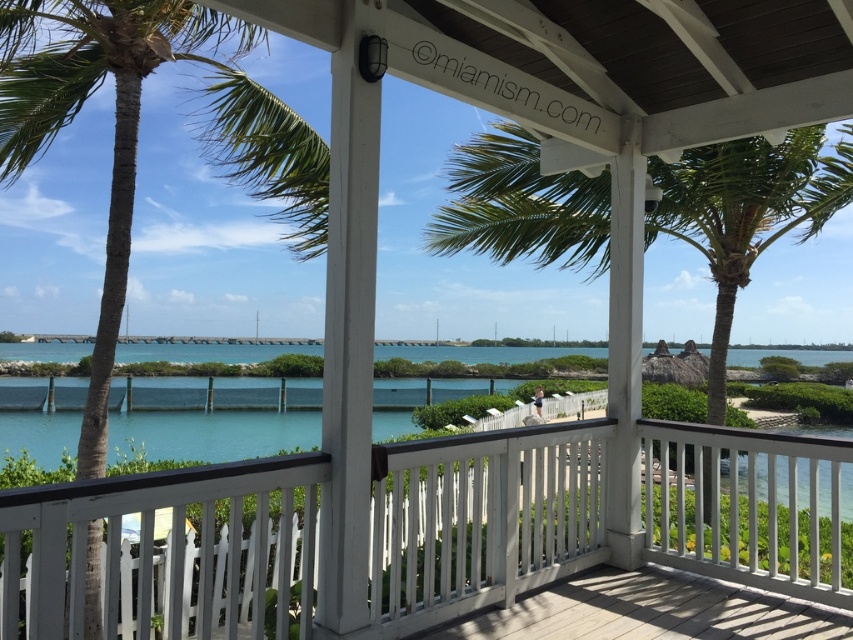
In the scene shown: You are standing on the wooden deck under the gazebo and want to pick a leaf from the green leafy palm tree at left. Can you reach it without moving from your current position?

The green leafy palm tree at left is 4.40 meters away from the viewer. Since the average person can only reach about 2 meters, you cannot reach the leaf without moving closer.

You are standing on the wooden deck under the white gazebo and notice the white wooden railing at center and the green leafy palm tree at center. From your perspective, which object is positioned to the right?

The white wooden railing at center is to the right of the green leafy palm tree at center, so the white wooden railing at center is positioned to the right.

In the scene shown: You are standing on the wooden deck and want to compare the sizes of the objects around you. Which object is wider between the white wooden railing at center and the green leafy palm tree at left?

The white wooden railing at center is wider than the green leafy palm tree at left according to the description.